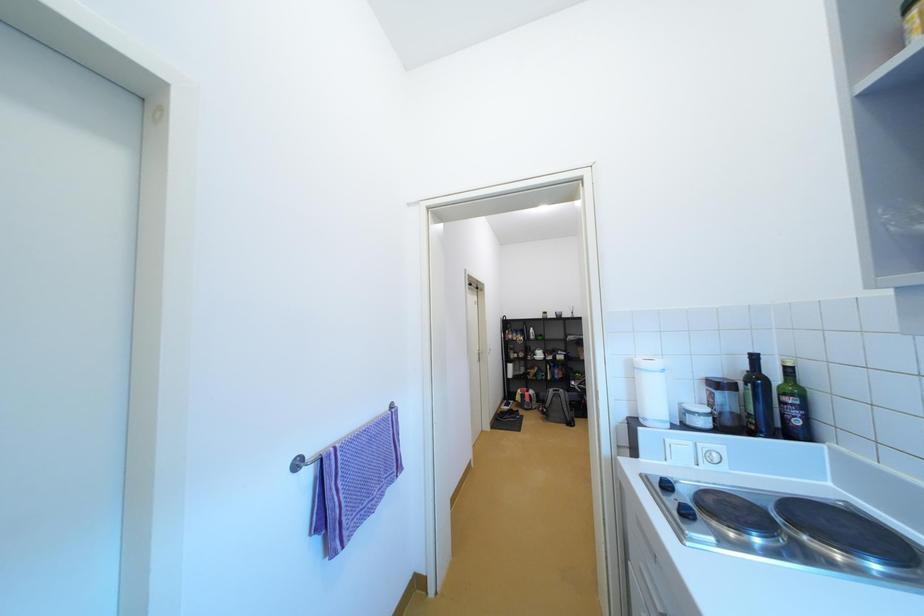
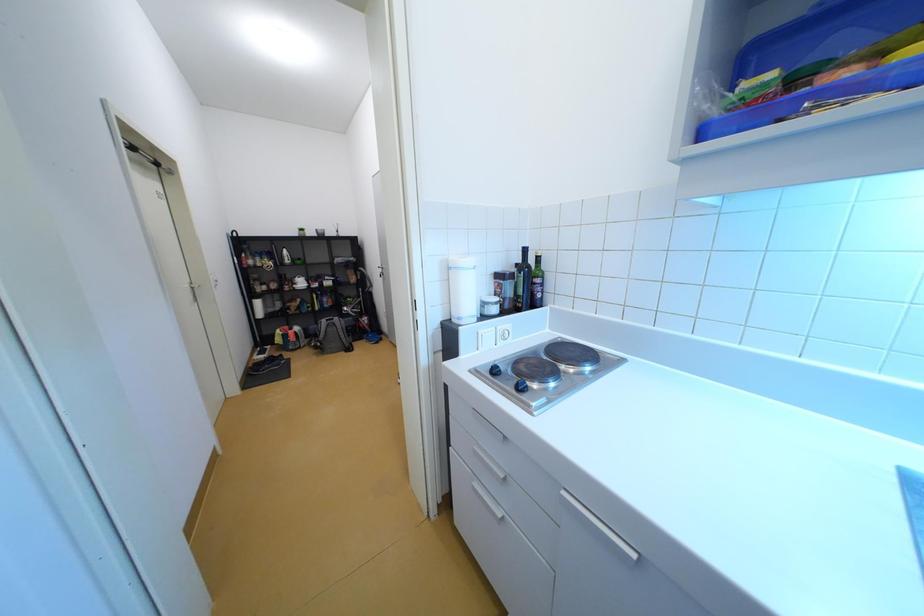
How did the camera likely rotate?

The camera's rotation is toward right-down.